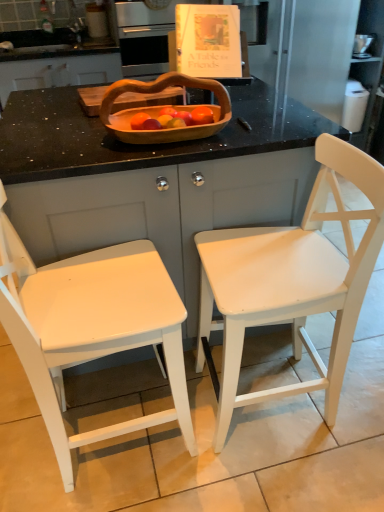
What is the approximate height of matte wood counter at center?

matte wood counter at center is 35.98 inches in height.

Locate an element on the screen. This screenshot has width=384, height=512. wooden basket at center is located at coordinates (160, 110).

Identify the location of matte wood counter at center. This screenshot has height=512, width=384. (153, 180).

Does matte white book at upper center have a larger size compared to white painted wood chair at right, the 2th chair positioned from the left?

Incorrect, matte white book at upper center is not larger than white painted wood chair at right, the 2th chair positioned from the left.

Can white painted wood chair at right, the 2th chair positioned from the left, be found inside matte white book at upper center?

Actually, white painted wood chair at right, the 2th chair positioned from the left, is outside matte white book at upper center.

Is matte white book at upper center in front of or behind white painted wood chair at right, marked as the 1th chair in a right-to-left arrangement, in the image?

matte white book at upper center is positioned farther from the viewer than white painted wood chair at right, marked as the 1th chair in a right-to-left arrangement.

In the scene shown: Is white painted wood chair at left, which is the first chair in left-to-right order, with wooden cutting board at upper center?

They are not placed beside each other.

From a real-world perspective, is white painted wood chair at left, which is the first chair in left-to-right order, on top of wooden cutting board at upper center?

No.

Which is behind, white painted wood chair at left, which is the first chair in left-to-right order, or wooden cutting board at upper center?

wooden cutting board at upper center.

Can you confirm if white painted wood chair at left, which ranks as the 2th chair in right-to-left order, is smaller than wooden cutting board at upper center?

Incorrect, white painted wood chair at left, which ranks as the 2th chair in right-to-left order, is not smaller in size than wooden cutting board at upper center.

Considering the positions of points (185, 138) and (341, 347), is point (185, 138) closer to camera compared to point (341, 347)?

Yes, it is.

Is wooden basket at center positioned before white painted wood chair at right, marked as the 1th chair in a right-to-left arrangement?

No, wooden basket at center is behind white painted wood chair at right, marked as the 1th chair in a right-to-left arrangement.

Considering the relative sizes of wooden basket at center and white painted wood chair at right, the 2th chair positioned from the left, in the image provided, is wooden basket at center bigger than white painted wood chair at right, the 2th chair positioned from the left,?

No, wooden basket at center is not bigger than white painted wood chair at right, the 2th chair positioned from the left.

Based on the photo, from the image's perspective, is wooden basket at center located above white painted wood chair at right, marked as the 1th chair in a right-to-left arrangement?

Yes, from the image's perspective, wooden basket at center is over white painted wood chair at right, marked as the 1th chair in a right-to-left arrangement.

From the image's perspective, relative to wooden cutting board at upper center, is matte wood counter at center above or below?

Based on their image positions, matte wood counter at center is located beneath wooden cutting board at upper center.

Is matte wood counter at center oriented away from wooden cutting board at upper center?

matte wood counter at center is not turned away from wooden cutting board at upper center.

Based on the photo, is matte wood counter at center wider or thinner than wooden cutting board at upper center?

In the image, matte wood counter at center appears to be wider than wooden cutting board at upper center.

How much distance is there between matte wood counter at center and wooden cutting board at upper center?

matte wood counter at center and wooden cutting board at upper center are 11.64 inches apart.

From the image's perspective, which one is positioned higher, white painted wood chair at left, which is the first chair in left-to-right order, or matte white book at upper center?

matte white book at upper center appears higher in the image.

Is white painted wood chair at left, which ranks as the 2th chair in right-to-left order, bigger than matte white book at upper center?

No, white painted wood chair at left, which ranks as the 2th chair in right-to-left order, is not bigger than matte white book at upper center.

From a real-world perspective, between white painted wood chair at left, which is the first chair in left-to-right order, and matte white book at upper center, who is vertically lower?

In real-world perspective, white painted wood chair at left, which is the first chair in left-to-right order, is lower.

Are white painted wood chair at left, which is the first chair in left-to-right order, and matte white book at upper center located far from each other?

Absolutely, white painted wood chair at left, which is the first chair in left-to-right order, is distant from matte white book at upper center.

Is matte wood counter at center far away from wooden basket at center?

No.

In the scene shown: From the image's perspective, which one is positioned lower, matte wood counter at center or wooden basket at center?

matte wood counter at center.

Which of these two, matte wood counter at center or wooden basket at center, is wider?

Wider between the two is matte wood counter at center.

How far apart are matte wood counter at center and wooden basket at center?

matte wood counter at center and wooden basket at center are 8.62 inches apart from each other.

Is wooden basket at center to the left of matte white book at upper center from the viewer's perspective?

No.

From a real-world perspective, is wooden basket at center physically above matte white book at upper center?

Indeed, from a real-world perspective, wooden basket at center stands above matte white book at upper center.

The image size is (384, 512). I want to click on basket above the matte white book at upper center (from a real-world perspective), so click(160, 110).

Are wooden basket at center and matte white book at upper center beside each other?

wooden basket at center and matte white book at upper center are clearly separated.

Find the location of a particular element. Image resolution: width=384 pixels, height=512 pixels. kitchen appliance on the left of white painted wood chair at right, marked as the 1th chair in a right-to-left arrangement is located at coordinates (144, 38).

At what (x,y) coordinates should I click in order to perform the action: click on cutting board that appears above the white painted wood chair at left, which ranks as the 2th chair in right-to-left order (from the image's perspective). Please return your answer as a coordinate pair (x, y). Looking at the image, I should click on (148, 99).

Estimate the real-world distances between objects in this image. Which object is closer to wooden basket at center, matte wood counter at center or matte white book at upper center?

Based on the image, matte wood counter at center appears to be nearer to wooden basket at center.

Considering their positions, is white painted wood chair at right, the 2th chair positioned from the left, positioned further to matte white book at upper center than wooden basket at center?

white painted wood chair at right, the 2th chair positioned from the left.

Which object lies further to the anchor point wooden cutting board at upper center, white painted wood chair at right, marked as the 1th chair in a right-to-left arrangement, or matte white book at upper center?

Based on the image, matte white book at upper center appears to be further to wooden cutting board at upper center.

When comparing their distances from white painted wood chair at left, which is the first chair in left-to-right order, does wooden basket at center or matte white book at upper center seem further?

Among the two, matte white book at upper center is located further to white painted wood chair at left, which is the first chair in left-to-right order.

Which object lies nearer to the anchor point white painted wood chair at left, which is the first chair in left-to-right order, matte wood counter at center or wooden cutting board at upper center?

Based on the image, matte wood counter at center appears to be nearer to white painted wood chair at left, which is the first chair in left-to-right order.

When comparing their distances from matte wood counter at center, does matte white book at upper center or wooden cutting board at upper center seem further?

Based on the image, matte white book at upper center appears to be further to matte wood counter at center.

When comparing their distances from matte wood counter at center, does white painted wood chair at right, marked as the 1th chair in a right-to-left arrangement, or wooden basket at center seem closer?

The object closer to matte wood counter at center is wooden basket at center.

From the image, which object appears to be nearer to white painted wood chair at right, marked as the 1th chair in a right-to-left arrangement, matte white book at upper center or wooden basket at center?

wooden basket at center is positioned closer to the anchor white painted wood chair at right, marked as the 1th chair in a right-to-left arrangement.

The height and width of the screenshot is (512, 384). Find the location of `counter positioned between white painted wood chair at left, which ranks as the 2th chair in right-to-left order, and matte white book at upper center from near to far`. counter positioned between white painted wood chair at left, which ranks as the 2th chair in right-to-left order, and matte white book at upper center from near to far is located at coordinates (153, 180).

This screenshot has width=384, height=512. I want to click on cutting board between matte white book at upper center and white painted wood chair at left, which ranks as the 2th chair in right-to-left order, in the vertical direction, so click(148, 99).

Find the location of a particular element. The image size is (384, 512). counter between wooden basket at center and white painted wood chair at right, the 2th chair positioned from the left, vertically is located at coordinates (153, 180).

Identify the location of basket between wooden cutting board at upper center and white painted wood chair at right, marked as the 1th chair in a right-to-left arrangement, vertically. (160, 110).